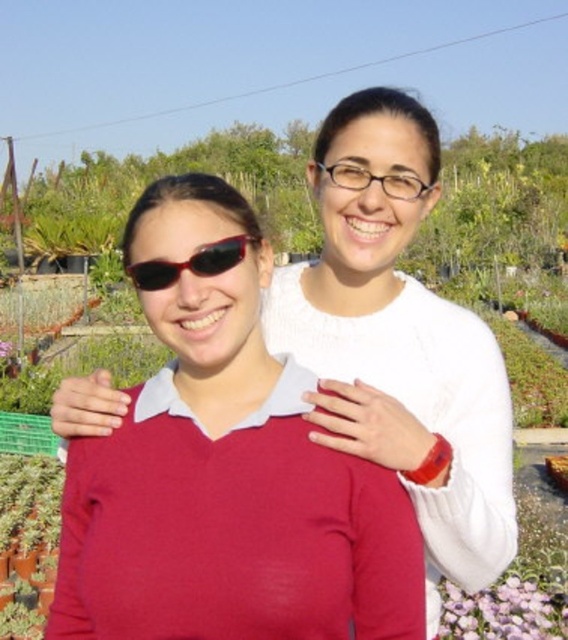
Is point (528, 637) positioned after point (152, 280)?

Yes, point (528, 637) is behind point (152, 280).

Does purple matte flower at lower right have a greater height compared to black plastic sunglasses at center?

Correct, purple matte flower at lower right is much taller as black plastic sunglasses at center.

This screenshot has height=640, width=568. Find the location of `purple matte flower at lower right`. purple matte flower at lower right is located at coordinates (504, 611).

Can you confirm if matte red sweater at center is shorter than black plastic sunglasses at center?

No.

Between matte red sweater at center and black plastic sunglasses at center, which one is positioned higher?

black plastic sunglasses at center is above.

Is point (191, 291) more distant than point (156, 282)?

No, it is not.

Locate an element on the screen. matte red sweater at center is located at coordinates (225, 476).

Is matte red sweater at center above purple matte flower at lower right?

Yes, matte red sweater at center is above purple matte flower at lower right.

Between matte red sweater at center and purple matte flower at lower right, which one has more height?

matte red sweater at center

What do you see at coordinates (225, 476) in the screenshot?
I see `matte red sweater at center` at bounding box center [225, 476].

Where is `matte red sweater at center`? The height and width of the screenshot is (640, 568). matte red sweater at center is located at coordinates (225, 476).